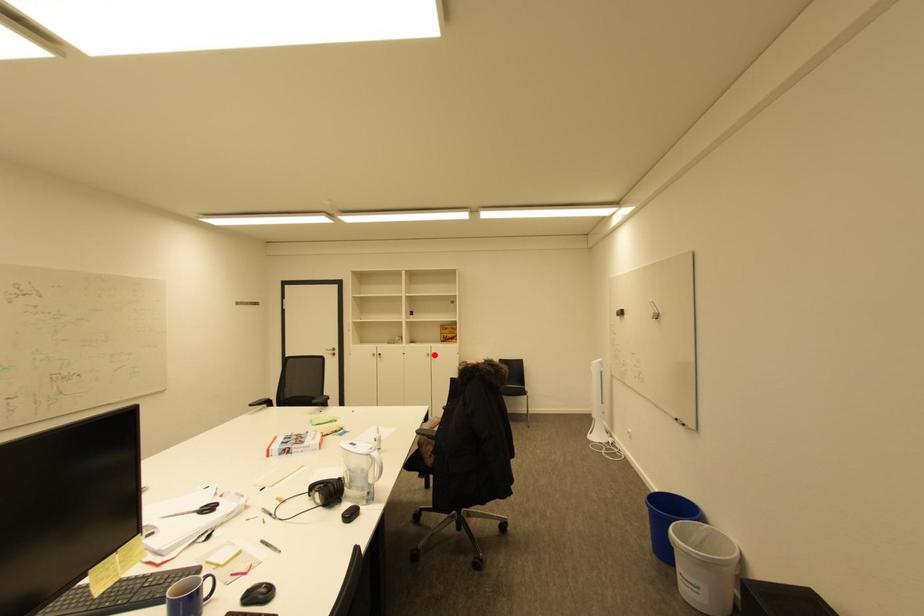
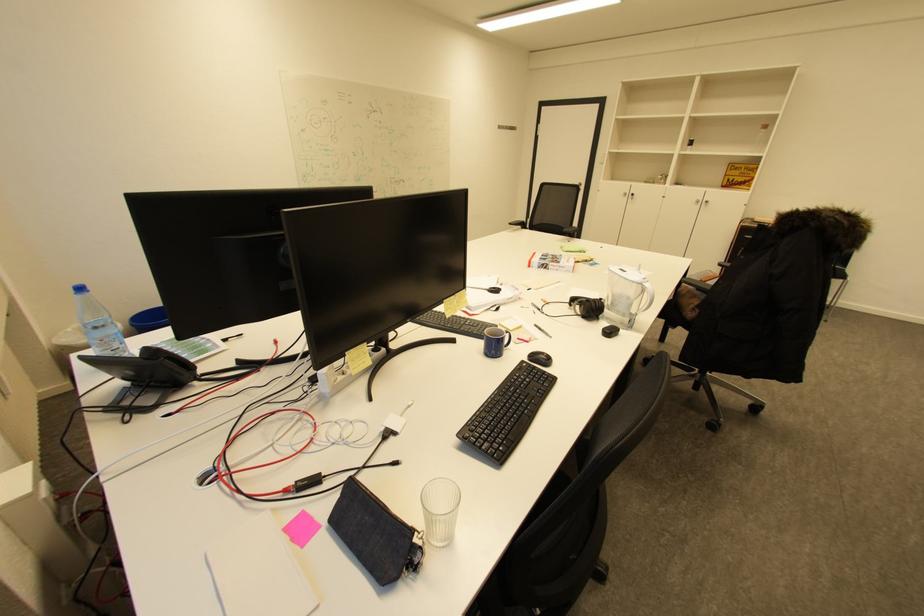
Find the pixel in the second image that matches the highlighted location in the first image.

(703, 201)